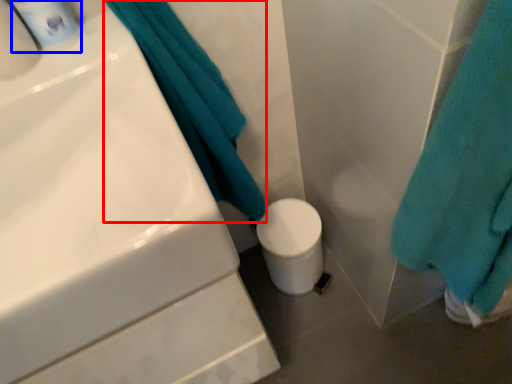
Question: Which object appears farthest to the camera in this image, bath towel (highlighted by a red box) or mouthwash (highlighted by a blue box)?

Choices:
 (A) bath towel
 (B) mouthwash

Answer: (A)